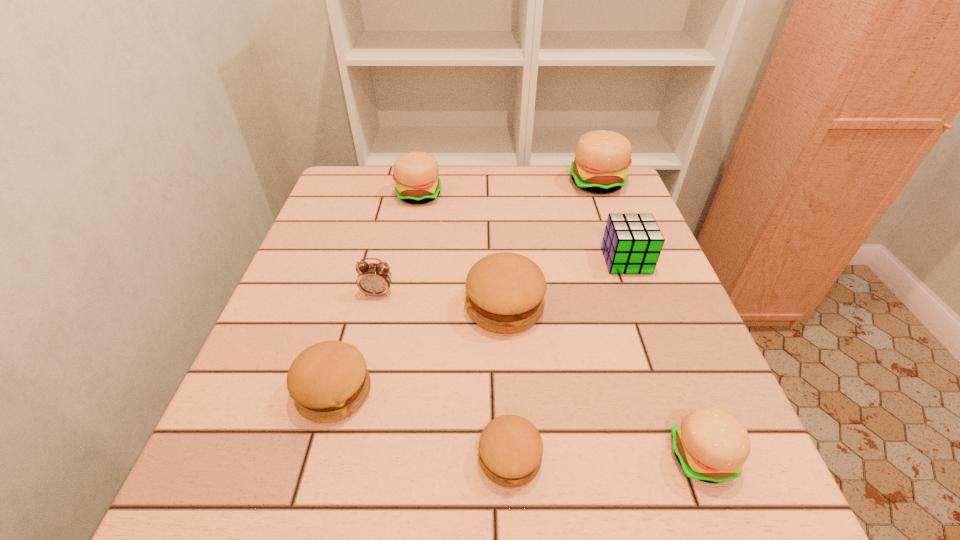
Locate an element on the screen. Image resolution: width=960 pixels, height=540 pixels. vacant space located 0.300m on the left of the shortest hamburger is located at coordinates (284, 458).

The image size is (960, 540). I want to click on object present at the left edge, so click(328, 381).

At what (x,y) coordinates should I click in order to perform the action: click on cube present at the right edge. Please return your answer as a coordinate pair (x, y). This screenshot has width=960, height=540. Looking at the image, I should click on (632, 243).

The image size is (960, 540). What are the coordinates of `object that is positioned at the far right corner` in the screenshot? It's located at (602, 158).

Find the location of a particular element. This screenshot has height=540, width=960. object that is at the near right corner is located at coordinates click(711, 445).

Locate an element on the screen. The width and height of the screenshot is (960, 540). free point at the far edge is located at coordinates (454, 207).

Image resolution: width=960 pixels, height=540 pixels. In order to click on vacant space at the near edge of the desktop in this screenshot , I will do `click(607, 514)`.

This screenshot has width=960, height=540. What are the coordinates of `vacant area at the left edge of the desktop` in the screenshot? It's located at (310, 264).

Locate an element on the screen. free space at the right edge of the desktop is located at coordinates 588,244.

Where is `vacant region at the far left corner of the desktop`? Image resolution: width=960 pixels, height=540 pixels. vacant region at the far left corner of the desktop is located at coordinates (354, 181).